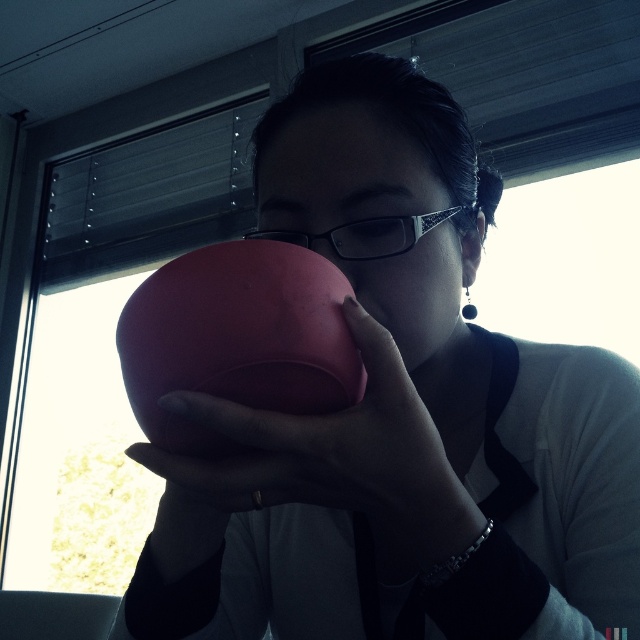
Which of these two, matte pink cup at center or matte pink piggy bank at center, stands shorter?

matte pink piggy bank at center is shorter.

Is point (172, 460) farther from camera compared to point (208, 328)?

Yes, point (172, 460) is farther from viewer.

You are a GUI agent. You are given a task and a screenshot of the screen. Output one action in this format:
    pyautogui.click(x=<x>, y=<y>)
    Task: Click on the matte pink cup at center
    The height and width of the screenshot is (640, 640).
    Given the screenshot: What is the action you would take?
    pyautogui.click(x=321, y=461)

At what (x,y) coordinates should I click in order to perform the action: click on matte pink bowl at center. Please return your answer as a coordinate pair (x, y). The height and width of the screenshot is (640, 640). Looking at the image, I should click on (401, 417).

Can you confirm if matte pink bowl at center is smaller than matte pink cup at center?

Incorrect, matte pink bowl at center is not smaller in size than matte pink cup at center.

Who is more forward, (604, 397) or (470, 515)?

Point (470, 515) is more forward.

Find the location of a particular element. The image size is (640, 640). matte pink bowl at center is located at coordinates (401, 417).

Does matte pink bowl at center have a lesser height compared to matte pink piggy bank at center?

Incorrect, matte pink bowl at center's height does not fall short of matte pink piggy bank at center's.

Between matte pink bowl at center and matte pink piggy bank at center, which one has more height?

matte pink bowl at center is taller.

Locate an element on the screen. The width and height of the screenshot is (640, 640). matte pink bowl at center is located at coordinates (401, 417).

Where is `matte pink bowl at center`? The height and width of the screenshot is (640, 640). matte pink bowl at center is located at coordinates (x=401, y=417).